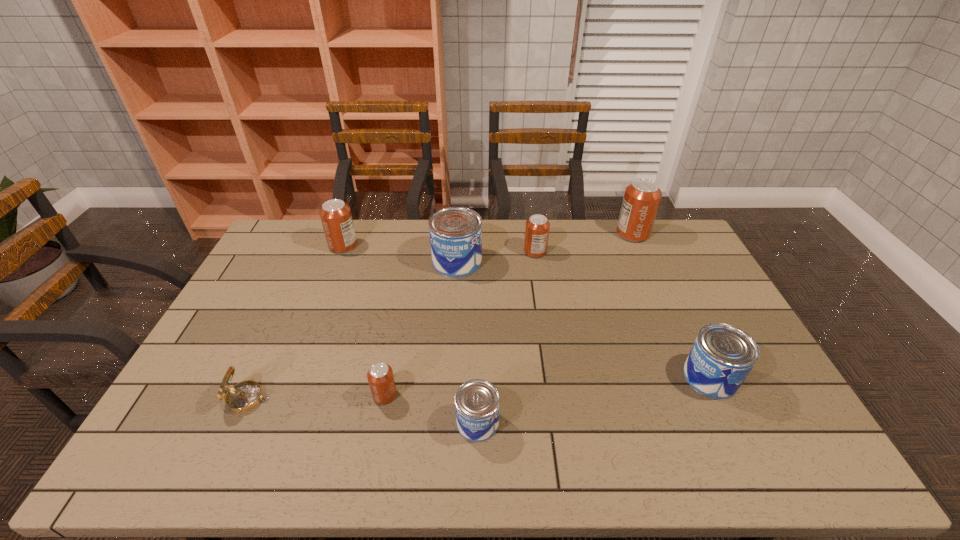
Find the location of `free space that satisfies the following two spatial constraints: 1. on the front side of the second orange can from right to left; 2. on the right side of the third smallest orange can`. free space that satisfies the following two spatial constraints: 1. on the front side of the second orange can from right to left; 2. on the right side of the third smallest orange can is located at coordinates (341, 252).

Where is `vacant space that satisfies the following two spatial constraints: 1. on the front label of the biggest blue can; 2. on the front side of the nearest orange can`? This screenshot has width=960, height=540. vacant space that satisfies the following two spatial constraints: 1. on the front label of the biggest blue can; 2. on the front side of the nearest orange can is located at coordinates (448, 395).